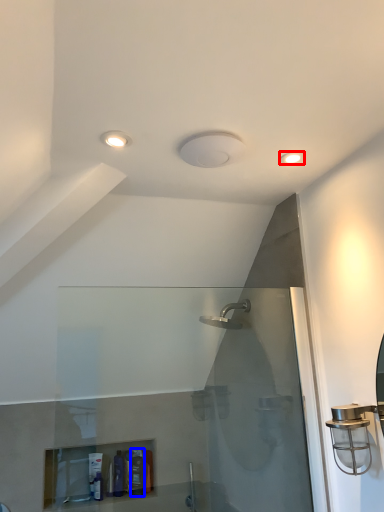
Question: Among these objects, which one is nearest to the camera, light fixture (highlighted by a red box) or toiletry (highlighted by a blue box)?

Choices:
 (A) light fixture
 (B) toiletry

Answer: (A)